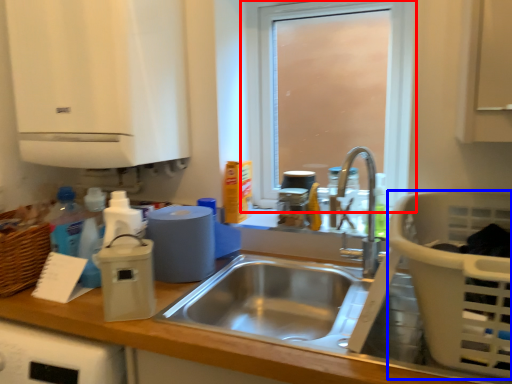
Question: Among these objects, which one is nearest to the camera, window (highlighted by a red box) or basket (highlighted by a blue box)?

Choices:
 (A) window
 (B) basket

Answer: (B)